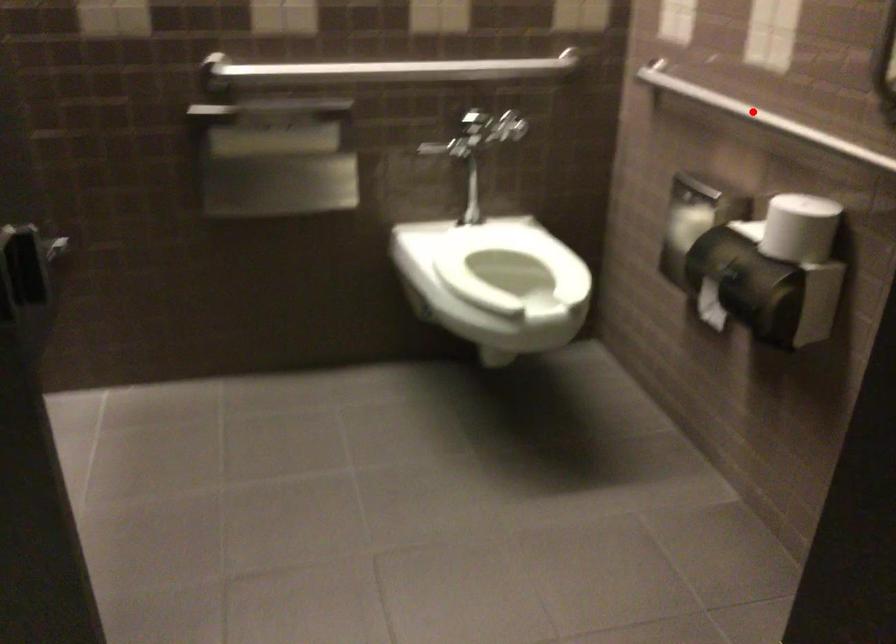
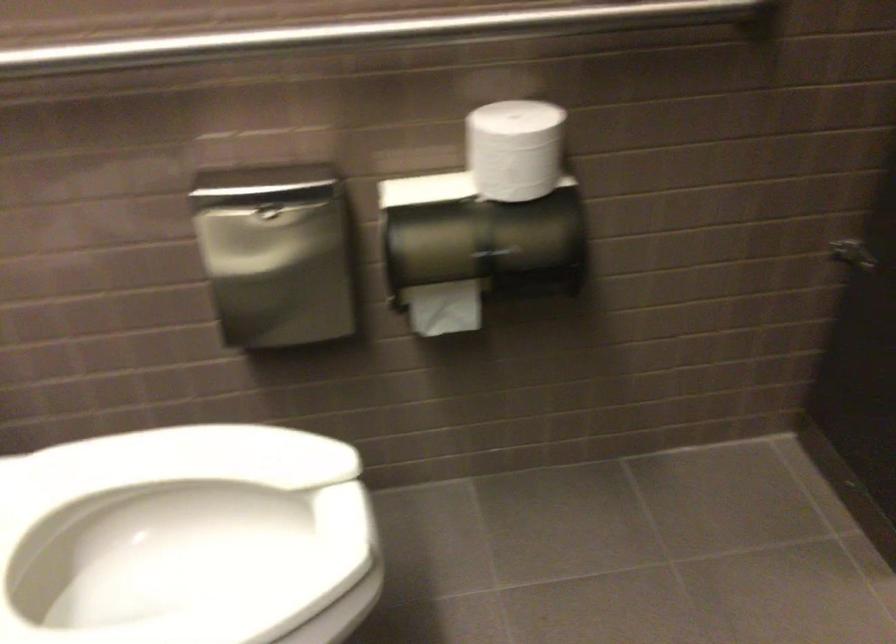
Locate, in the second image, the point that corresponds to the highlighted location in the first image.

(368, 33)